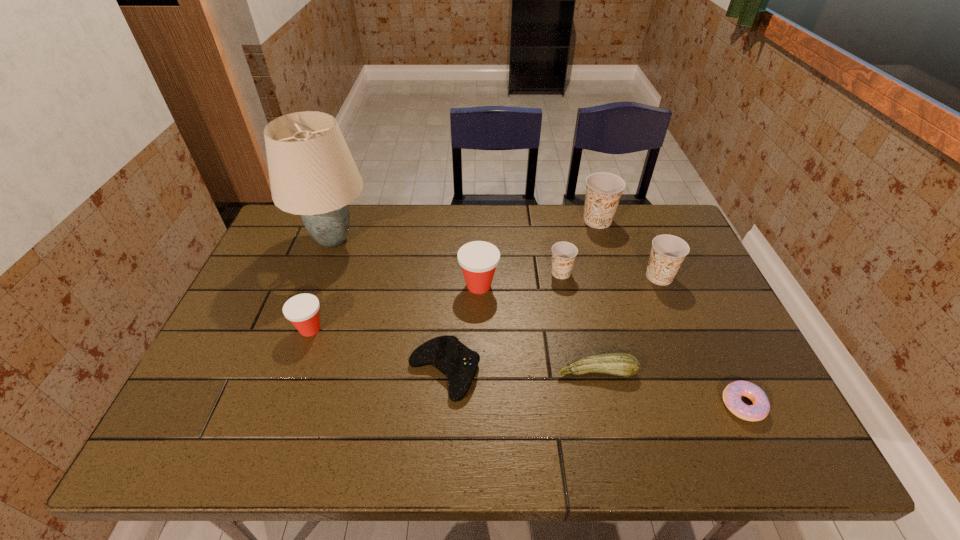
Image resolution: width=960 pixels, height=540 pixels. I want to click on vacant space located on the back of the nearest Dixie cup, so click(x=322, y=298).

This screenshot has width=960, height=540. I want to click on free space located 0.090m on the right of the leftmost orange Dixie cup, so click(604, 273).

Where is `vacant space located 0.050m at the stem end of the green zucchini`? This screenshot has width=960, height=540. vacant space located 0.050m at the stem end of the green zucchini is located at coordinates (603, 400).

I want to click on free space located on the left of the control, so click(288, 372).

At what (x,y) coordinates should I click in order to perform the action: click on free space located on the left of the doughnut. Please return your answer as a coordinate pair (x, y). Looking at the image, I should click on (586, 404).

Image resolution: width=960 pixels, height=540 pixels. I want to click on lampshade present at the far edge, so click(312, 173).

At what (x,y) coordinates should I click in order to perform the action: click on Dixie cup that is at the far edge. Please return your answer as a coordinate pair (x, y). This screenshot has height=540, width=960. Looking at the image, I should click on (603, 190).

Where is `object present at the near edge`? The image size is (960, 540). object present at the near edge is located at coordinates (732, 394).

Identify the location of object present at the left edge. (312, 173).

You are a GUI agent. You are given a task and a screenshot of the screen. Output one action in this format:
    pyautogui.click(x=<x>, y=<y>)
    Task: Click on the Dixie cup that is at the right edge
    
    Given the screenshot: What is the action you would take?
    pyautogui.click(x=668, y=251)